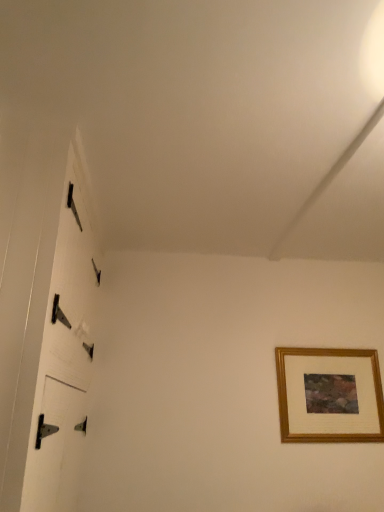
Question: Should I look upward or downward to see gold wooden picture frame at lower right?

Choices:
 (A) up
 (B) down

Answer: (B)

Question: From a real-world perspective, is metallic hinges at left below gold wooden picture frame at lower right?

Choices:
 (A) no
 (B) yes

Answer: (A)

Question: Does metallic hinges at left lie in front of gold wooden picture frame at lower right?

Choices:
 (A) yes
 (B) no

Answer: (A)

Question: Does metallic hinges at left appear on the right side of gold wooden picture frame at lower right?

Choices:
 (A) no
 (B) yes

Answer: (A)

Question: Is metallic hinges at left directly adjacent to gold wooden picture frame at lower right?

Choices:
 (A) no
 (B) yes

Answer: (A)

Question: Is metallic hinges at left completely or partially outside of gold wooden picture frame at lower right?

Choices:
 (A) no
 (B) yes

Answer: (B)

Question: Is metallic hinges at left positioned far away from gold wooden picture frame at lower right?

Choices:
 (A) no
 (B) yes

Answer: (B)

Question: Can you confirm if gold wooden picture frame at lower right is taller than metallic hinges at left?

Choices:
 (A) no
 (B) yes

Answer: (A)

Question: Is gold wooden picture frame at lower right shorter than metallic hinges at left?

Choices:
 (A) no
 (B) yes

Answer: (B)

Question: From a real-world perspective, is gold wooden picture frame at lower right physically above metallic hinges at left?

Choices:
 (A) no
 (B) yes

Answer: (A)

Question: Considering the relative sizes of gold wooden picture frame at lower right and metallic hinges at left in the image provided, is gold wooden picture frame at lower right bigger than metallic hinges at left?

Choices:
 (A) no
 (B) yes

Answer: (A)

Question: Is metallic hinges at left at the back of gold wooden picture frame at lower right?

Choices:
 (A) yes
 (B) no

Answer: (B)

Question: From a real-world perspective, is gold wooden picture frame at lower right below metallic hinges at left?

Choices:
 (A) yes
 (B) no

Answer: (A)

Question: From the image's perspective, is gold wooden picture frame at lower right positioned above or below metallic hinges at left?

Choices:
 (A) below
 (B) above

Answer: (A)